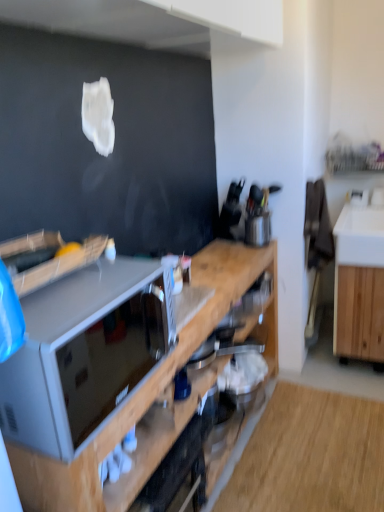
You are a GUI agent. You are given a task and a screenshot of the screen. Output one action in this format:
    pyautogui.click(x=<x>, y=<y>)
    Task: Click on the free location above matte gray microwave at center (from a real-world perspective)
    The image size is (384, 512).
    Given the screenshot: What is the action you would take?
    pyautogui.click(x=90, y=288)